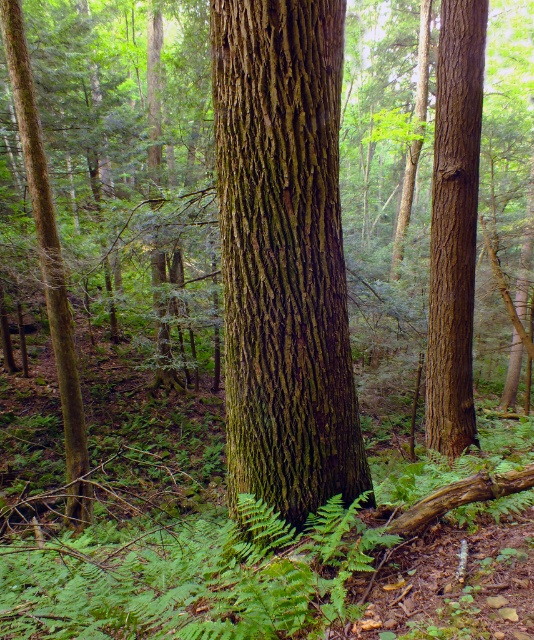
Who is more forward, [459,445] or [60,403]?

Point [459,445] is in front.

Between point (459, 337) and point (58, 284), which one is positioned behind?

Positioned behind is point (58, 284).

You are a GUI agent. You are given a task and a screenshot of the screen. Output one action in this format:
    pyautogui.click(x=<x>, y=<y>)
    Task: Click on the smooth brown tree trunk at right
    The height and width of the screenshot is (640, 534).
    Given the screenshot: What is the action you would take?
    pyautogui.click(x=453, y=227)

Who is more distant from viewer, (302, 4) or (45, 209)?

Result: The point (45, 209) is behind.

Does green rough bark tree trunk at center have a larger size compared to green rough bark tree at left?

Correct, green rough bark tree trunk at center is larger in size than green rough bark tree at left.

At what (x,y) coordinates should I click in order to perform the action: click on green rough bark tree trunk at center. Please return your answer as a coordinate pair (x, y). Looking at the image, I should click on (284, 253).

Between point (265, 317) and point (454, 65), which one is positioned behind?

Point (454, 65)

Measure the distance between point (260, 44) and camera.

2.95 meters

What do you see at coordinates (284, 253) in the screenshot?
I see `green rough bark tree trunk at center` at bounding box center [284, 253].

Locate an element on the screen. green rough bark tree trunk at center is located at coordinates (284, 253).